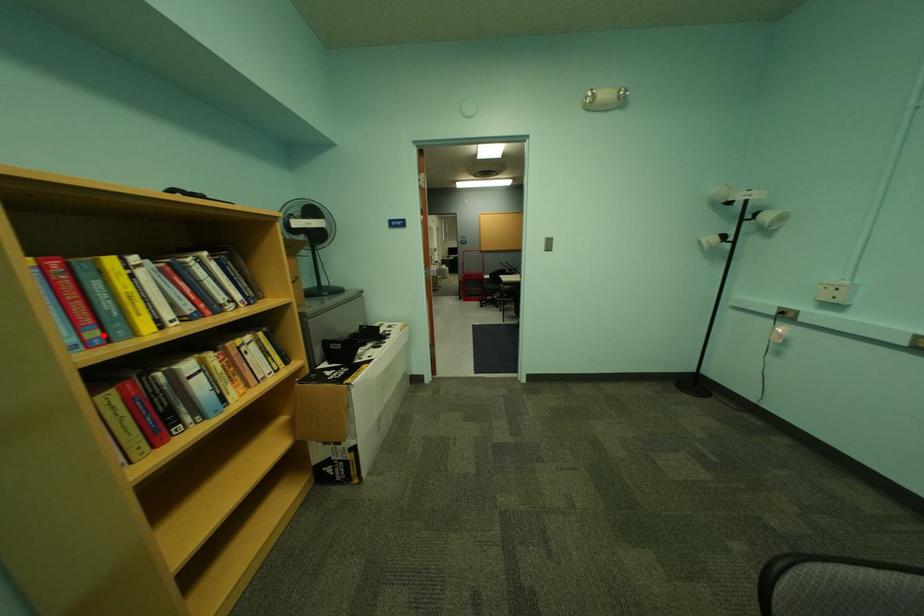
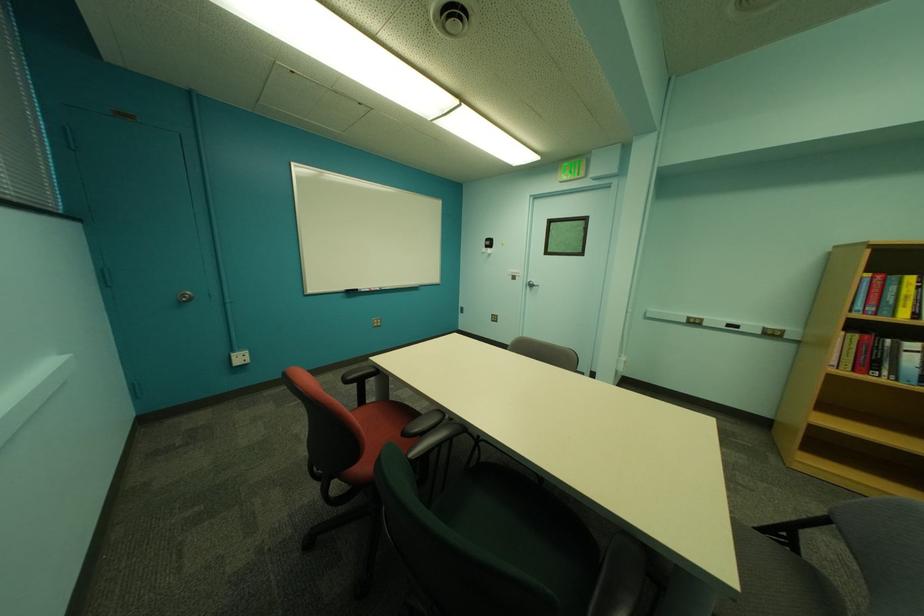
Find the pixel in the second image that matches the highlighted location in the first image.

(881, 310)